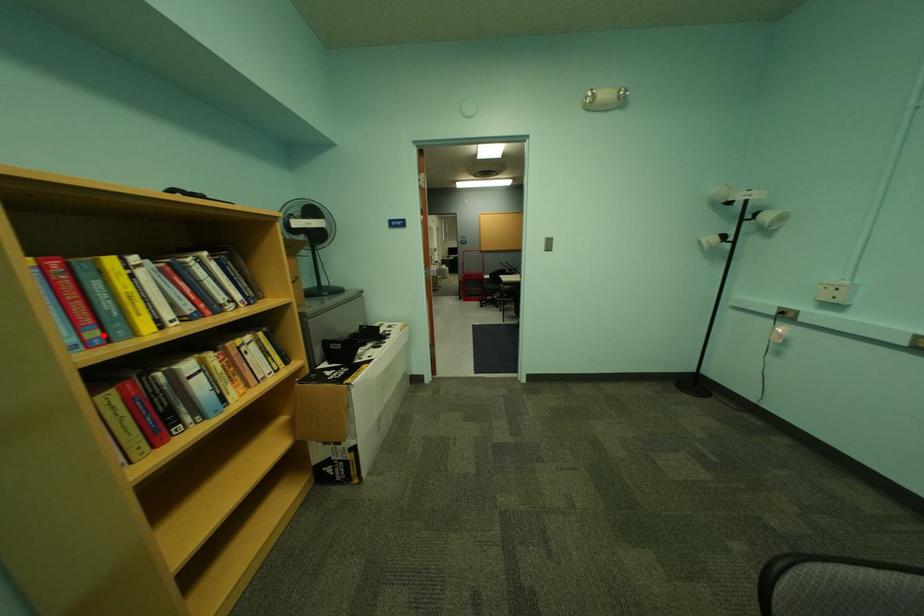
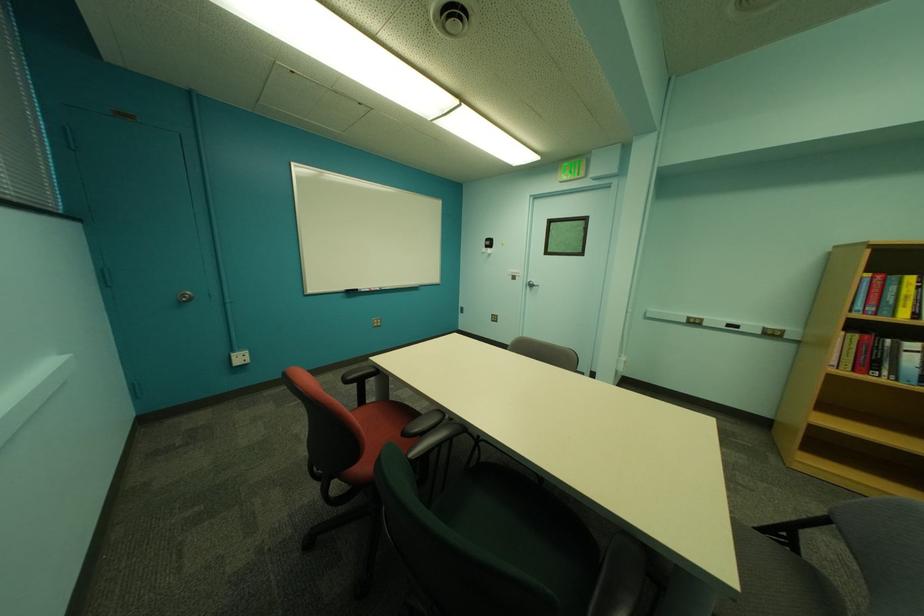
Find the pixel in the second image that matches the highlighted location in the first image.

(881, 310)